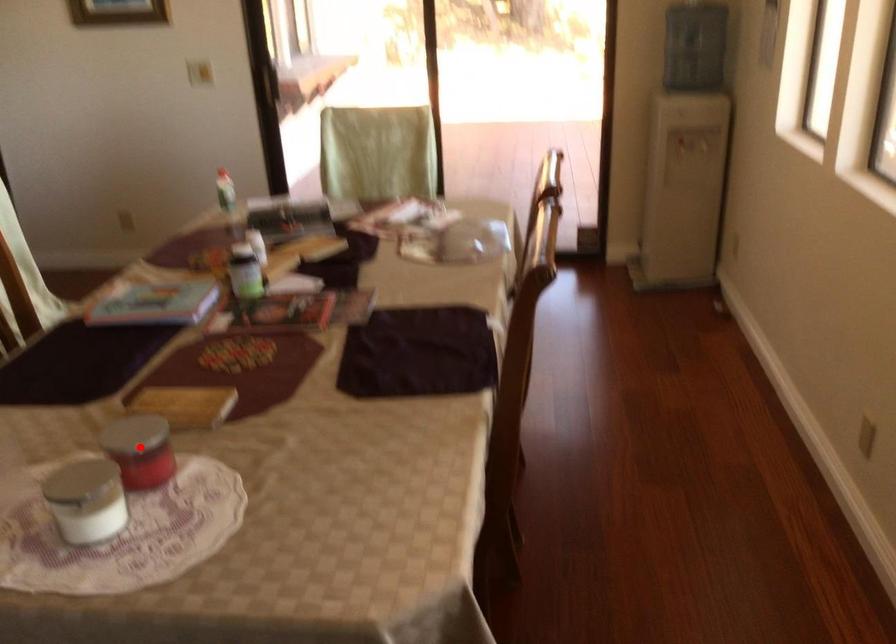
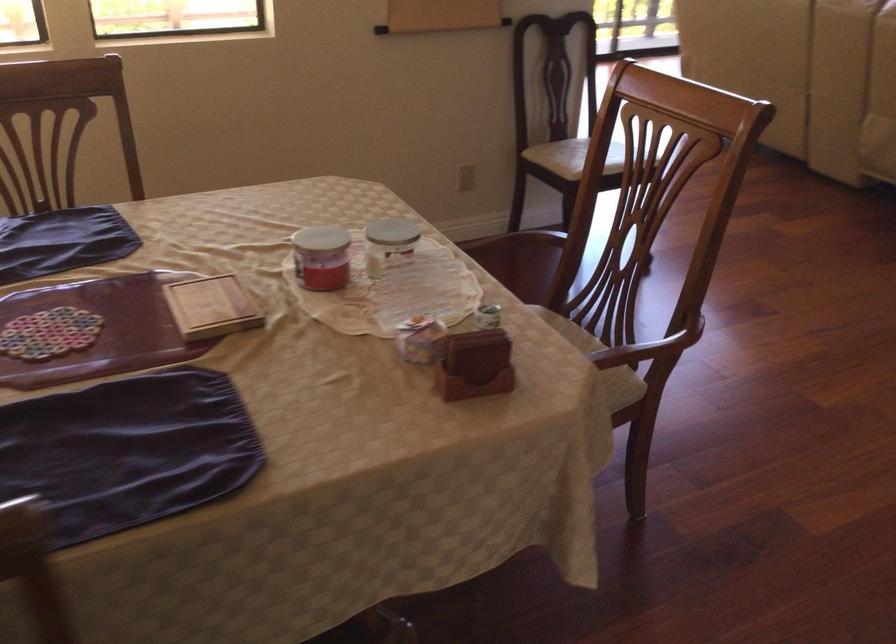
Question: I am providing you with two images of the same scene from different viewpoints. Given a red point in image1, look at the same physical point in image2. Is it:

Choices:
 (A) Closer to the viewpoint
 (B) Farther from the viewpoint

Answer: (B)